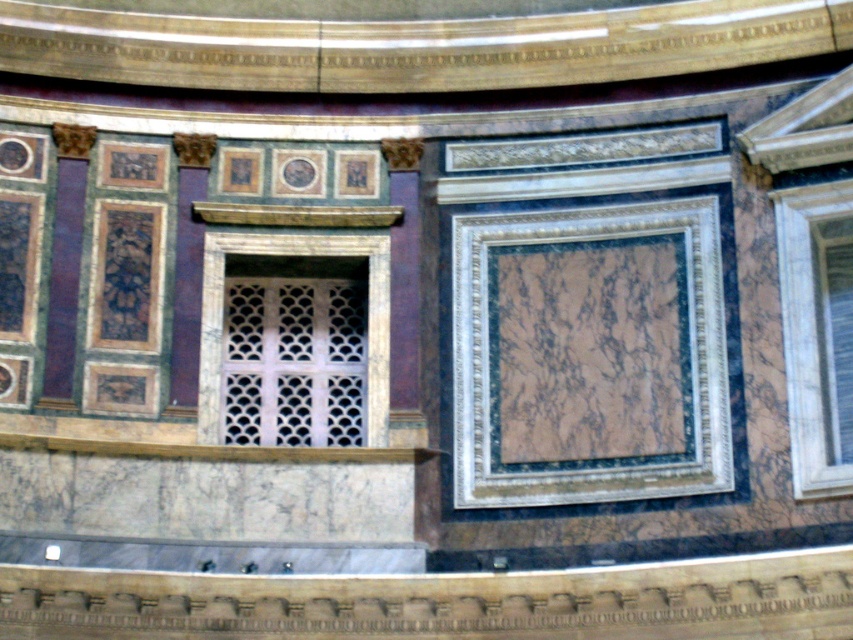
In the scene shown: Between marble at center and white marble window at center, which one has more height?

Standing taller between the two is marble at center.

Is marble at center below white marble window at center?

No, marble at center is not below white marble window at center.

You are a GUI agent. You are given a task and a screenshot of the screen. Output one action in this format:
    pyautogui.click(x=<x>, y=<y>)
    Task: Click on the marble at center
    
    Given the screenshot: What is the action you would take?
    coord(589,355)

Is marble at center to the left of white marble window at right from the viewer's perspective?

Indeed, marble at center is positioned on the left side of white marble window at right.

Is marble at center behind white marble window at right?

No.

Between point (708, 394) and point (850, 397), which one is positioned behind?

Positioned behind is point (708, 394).

Locate an element on the screen. This screenshot has width=853, height=640. marble at center is located at coordinates (589, 355).

Which is more to the left, white marble window at right or white marble window at center?

white marble window at center is more to the left.

Does point (805, 349) come closer to viewer compared to point (201, 330)?

Yes, it is.

Based on the photo, who is more forward, [805,214] or [276,244]?

Point [805,214]

Find the location of `white marble window at right`. white marble window at right is located at coordinates (817, 332).